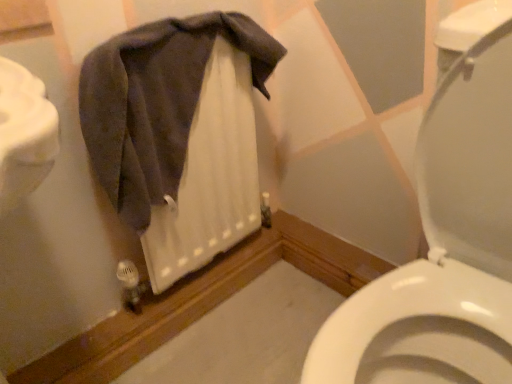
Question: Is point (239, 31) closer or farther from the camera than point (445, 279)?

Choices:
 (A) closer
 (B) farther

Answer: (B)

Question: From a real-world perspective, is dark gray cotton towel at upper left above or below white glossy toilet at center?

Choices:
 (A) above
 (B) below

Answer: (A)

Question: Based on their positions, is dark gray cotton towel at upper left located to the left or right of white glossy toilet at center?

Choices:
 (A) right
 (B) left

Answer: (B)

Question: Looking at their shapes, would you say white glossy toilet at center is wider or thinner than dark gray cotton towel at upper left?

Choices:
 (A) wide
 (B) thin

Answer: (A)

Question: Looking at the image, does white glossy toilet at center seem bigger or smaller compared to dark gray cotton towel at upper left?

Choices:
 (A) big
 (B) small

Answer: (A)

Question: Considering the relative positions of white glossy toilet at center and dark gray cotton towel at upper left in the image provided, is white glossy toilet at center to the left or to the right of dark gray cotton towel at upper left?

Choices:
 (A) right
 (B) left

Answer: (A)

Question: Considering their positions, is white glossy toilet at center located in front of or behind dark gray cotton towel at upper left?

Choices:
 (A) behind
 (B) front

Answer: (B)